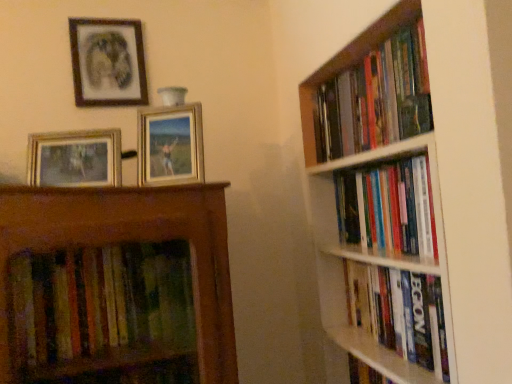
Question: Is hardcover book at right, which ranks as the third book in top-to-bottom order, taller than hardcover books at right, marked as the 2th book in a top-to-bottom arrangement?

Choices:
 (A) yes
 (B) no

Answer: (A)

Question: Is hardcover book at right, the first book positioned from the bottom, aimed at hardcover books at right, placed as the 2th book when sorted from bottom to top?

Choices:
 (A) yes
 (B) no

Answer: (B)

Question: Can you confirm if hardcover book at right, the first book positioned from the bottom, is shorter than hardcover books at right, placed as the 2th book when sorted from bottom to top?

Choices:
 (A) no
 (B) yes

Answer: (A)

Question: Is the position of hardcover book at right, which ranks as the third book in top-to-bottom order, more distant than that of hardcover books at right, marked as the 2th book in a top-to-bottom arrangement?

Choices:
 (A) no
 (B) yes

Answer: (B)

Question: Can you confirm if hardcover book at right, which ranks as the third book in top-to-bottom order, is wider than hardcover books at right, placed as the 2th book when sorted from bottom to top?

Choices:
 (A) yes
 (B) no

Answer: (B)

Question: Visually, is white wooden bookshelf at right positioned to the left or to the right of hardcover books at right, the 3th book in the bottom-to-top sequence?

Choices:
 (A) right
 (B) left

Answer: (B)

Question: Is point (355, 249) positioned closer to the camera than point (343, 89)?

Choices:
 (A) closer
 (B) farther

Answer: (A)

Question: From the image's perspective, relative to hardcover books at right, arranged as the first book when viewed from the top, is white wooden bookshelf at right above or below?

Choices:
 (A) below
 (B) above

Answer: (A)

Question: In terms of height, does white wooden bookshelf at right look taller or shorter compared to hardcover books at right, arranged as the first book when viewed from the top?

Choices:
 (A) tall
 (B) short

Answer: (A)

Question: From a real-world perspective, is hardcover books at right, the 3th book in the bottom-to-top sequence, above or below metallic gold picture frame at upper center, placed as the 2th picture frame when sorted from front to back?

Choices:
 (A) below
 (B) above

Answer: (B)

Question: Is hardcover books at right, the 3th book in the bottom-to-top sequence, taller or shorter than metallic gold picture frame at upper center, placed as the 2th picture frame when sorted from front to back?

Choices:
 (A) short
 (B) tall

Answer: (B)

Question: Relative to metallic gold picture frame at upper center, placed as the 2th picture frame when sorted from front to back, is hardcover books at right, the 3th book in the bottom-to-top sequence, in front or behind?

Choices:
 (A) front
 (B) behind

Answer: (A)

Question: Considering the positions of point (332, 86) and point (145, 153), is point (332, 86) closer or farther from the camera than point (145, 153)?

Choices:
 (A) farther
 (B) closer

Answer: (A)

Question: Visually, is hardcover books at right, marked as the 2th book in a top-to-bottom arrangement, positioned to the left or to the right of hardcover books at right, arranged as the first book when viewed from the top?

Choices:
 (A) right
 (B) left

Answer: (A)

Question: From a real-world perspective, is hardcover books at right, marked as the 2th book in a top-to-bottom arrangement, above or below hardcover books at right, arranged as the first book when viewed from the top?

Choices:
 (A) below
 (B) above

Answer: (A)